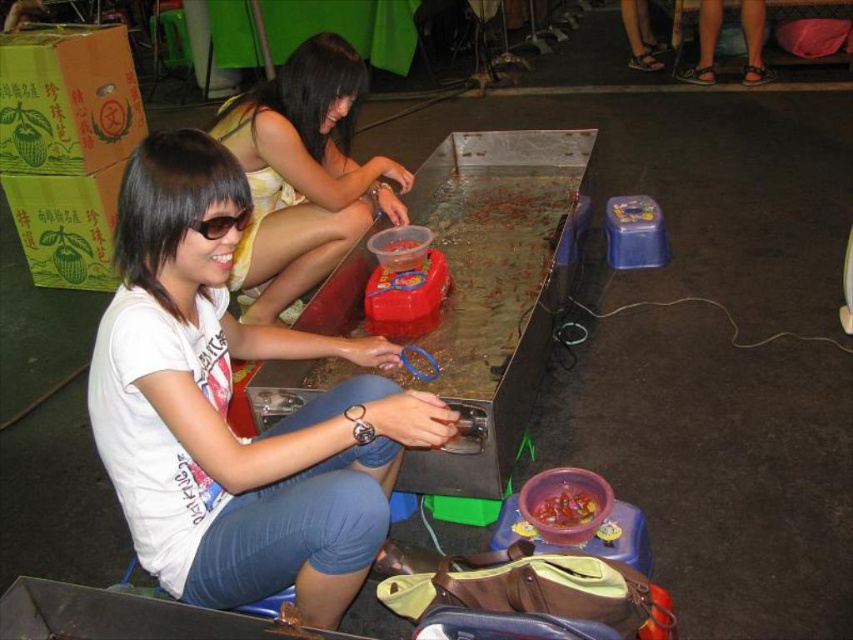
Is yellow fabric dress at center positioned at the back of black plastic goggles at left?

Yes, yellow fabric dress at center is behind black plastic goggles at left.

Does yellow fabric dress at center lie in front of black plastic goggles at left?

No, yellow fabric dress at center is behind black plastic goggles at left.

This screenshot has width=853, height=640. Find the location of `yellow fabric dress at center`. yellow fabric dress at center is located at coordinates (303, 173).

Who is positioned more to the left, yellow fabric dress at center or translucent plastic bowl at lower center?

From the viewer's perspective, yellow fabric dress at center appears more on the left side.

Can you confirm if yellow fabric dress at center is wider than translucent plastic bowl at lower center?

Yes, yellow fabric dress at center is wider than translucent plastic bowl at lower center.

This screenshot has width=853, height=640. What do you see at coordinates (303, 173) in the screenshot?
I see `yellow fabric dress at center` at bounding box center [303, 173].

Find the location of a particular element. The image size is (853, 640). yellow fabric dress at center is located at coordinates (303, 173).

Is white matte shirt at center thinner than black plastic goggles at left?

In fact, white matte shirt at center might be wider than black plastic goggles at left.

Does white matte shirt at center have a greater width compared to black plastic goggles at left?

Yes, white matte shirt at center is wider than black plastic goggles at left.

Describe the element at coordinates (225, 410) in the screenshot. I see `white matte shirt at center` at that location.

Where is `white matte shirt at center`? The image size is (853, 640). white matte shirt at center is located at coordinates (225, 410).